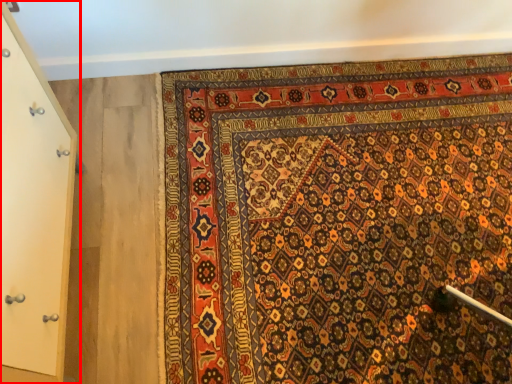
Question: Where is door (annotated by the red box) located in relation to mat in the image?

Choices:
 (A) right
 (B) left

Answer: (B)